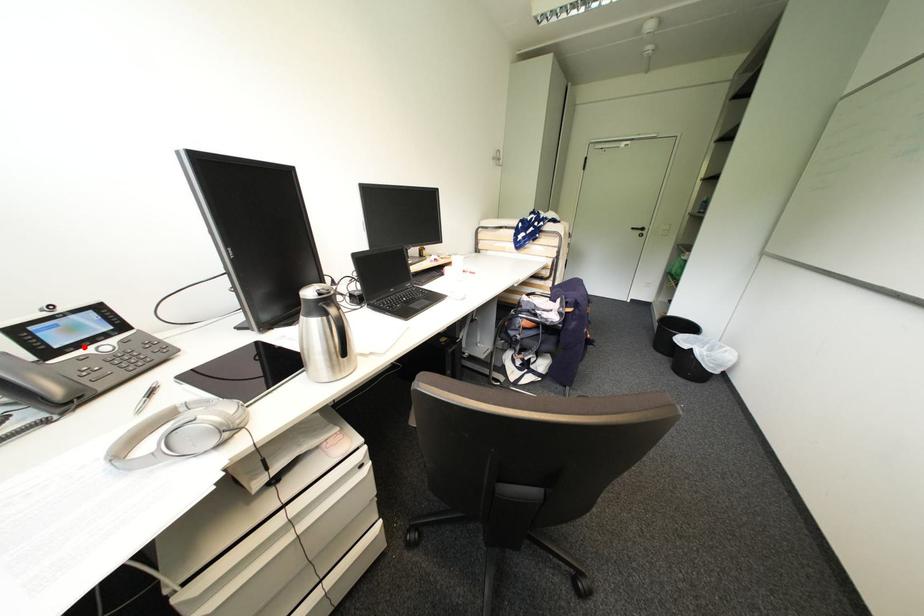
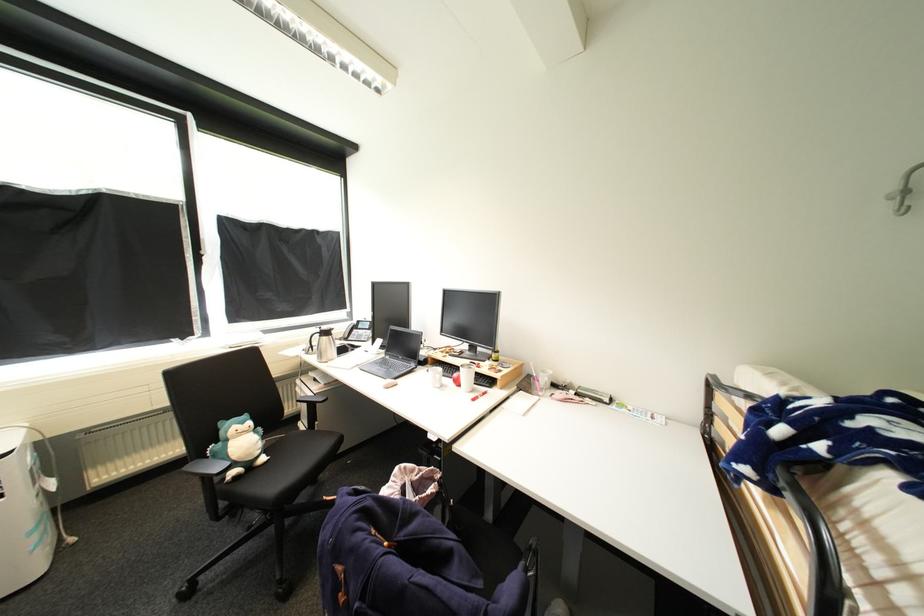
Locate, in the second image, the point that corresponds to the highlighted location in the first image.

(367, 330)